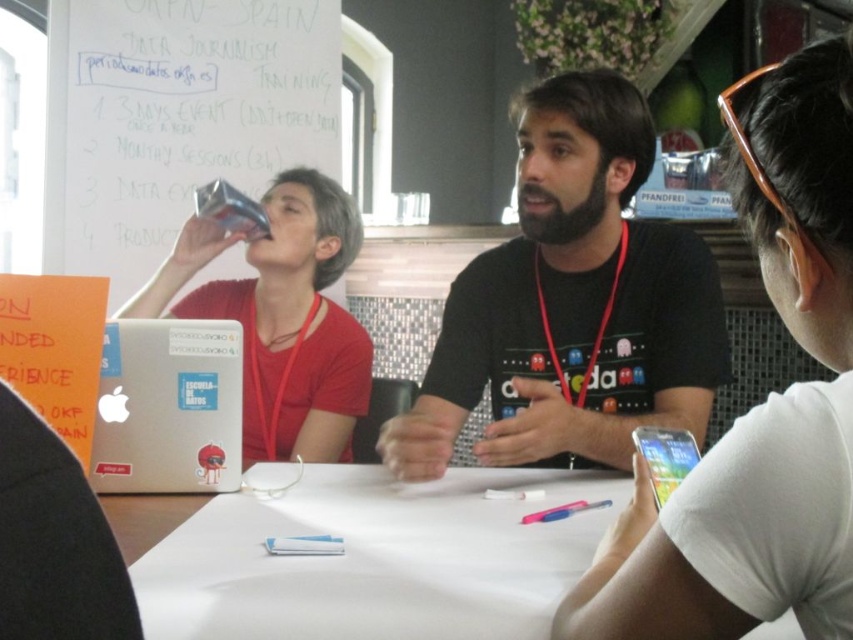
Question: Does silver metallic laptop at lower left have a lesser width compared to clear glass bottle at upper right?

Choices:
 (A) yes
 (B) no

Answer: (A)

Question: Which point is farther to the camera?

Choices:
 (A) (180, 564)
 (B) (585, 504)
 (C) (155, 356)
 (D) (177, 250)

Answer: (D)

Question: Which of the following is the farthest from the observer?

Choices:
 (A) (587, 220)
 (B) (233, 540)
 (C) (569, 513)

Answer: (A)

Question: Is matte black laptop at left further to the viewer compared to translucent plastic pen at lower center?

Choices:
 (A) yes
 (B) no

Answer: (A)

Question: Is black matte shirt at center positioned at the back of silver metallic laptop at lower left?

Choices:
 (A) no
 (B) yes

Answer: (A)

Question: Which of these objects is positioned farthest from the silver metallic laptop at lower left?

Choices:
 (A) black matte t-shirt at center
 (B) translucent plastic pen at lower center
 (C) clear glass bottle at upper right

Answer: (C)